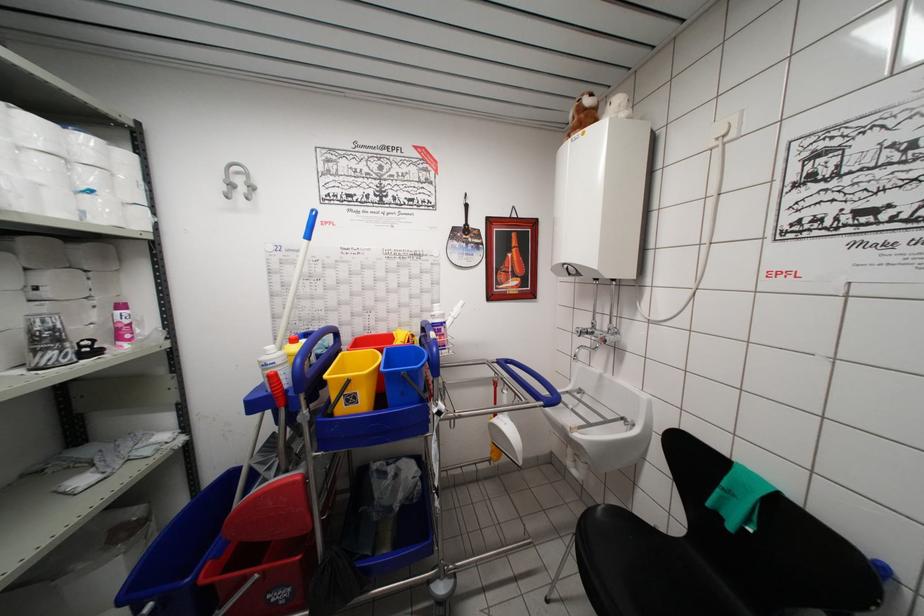
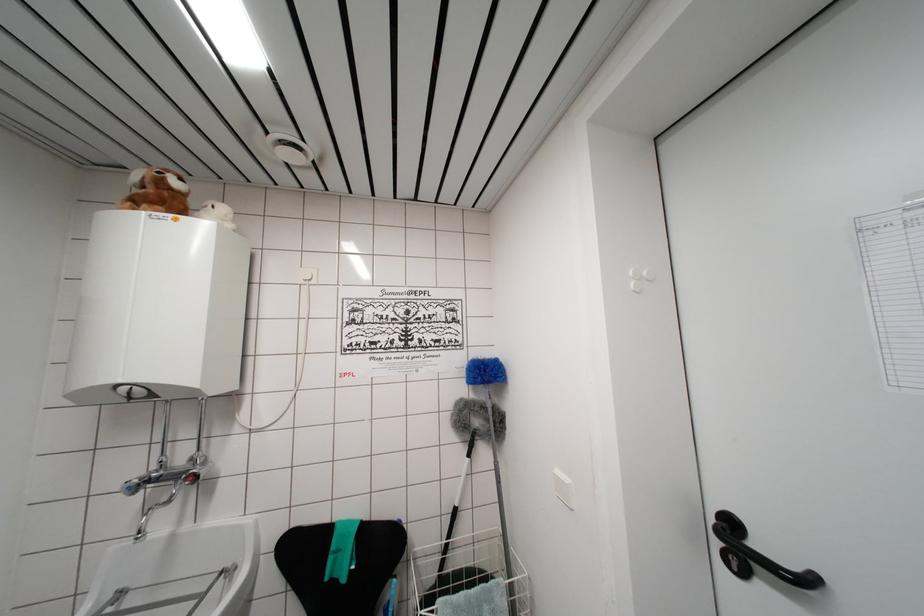
The point at (585, 131) is marked in the first image. Where is the corresponding point in the second image?

(168, 209)